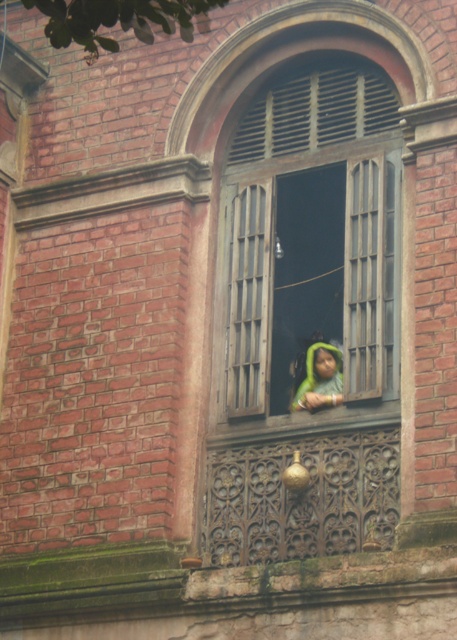
Question: Is wooden window at center to the right of green fabric at center from the viewer's perspective?

Choices:
 (A) yes
 (B) no

Answer: (A)

Question: Is wooden window at center closer to camera compared to green fabric at center?

Choices:
 (A) no
 (B) yes

Answer: (B)

Question: Which point is closer to the camera?

Choices:
 (A) (354, 97)
 (B) (334, 360)

Answer: (B)

Question: Is wooden window at center smaller than green fabric at center?

Choices:
 (A) no
 (B) yes

Answer: (A)